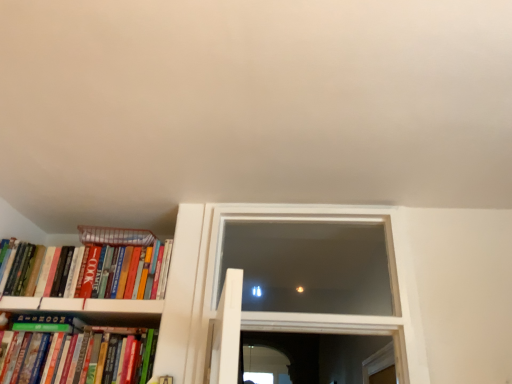
Where is `hardcover books at left, positioned as the 1th book in top-to-bottom order`? This screenshot has height=384, width=512. hardcover books at left, positioned as the 1th book in top-to-bottom order is located at coordinates (91, 269).

What do you see at coordinates (91, 269) in the screenshot? I see `hardcover books at left, positioned as the 1th book in top-to-bottom order` at bounding box center [91, 269].

What is the approximate width of striped paper at left?

striped paper at left is 10.35 inches in width.

This screenshot has height=384, width=512. What do you see at coordinates (115, 236) in the screenshot? I see `striped paper at left` at bounding box center [115, 236].

Measure the distance between transparent glass window at center and camera.

transparent glass window at center and camera are 1.61 meters apart.

What are the coordinates of `transparent glass window at center` in the screenshot? It's located at (313, 313).

How much space does green matte bookshelf at lower left, arranged as the 1th book when ordered from the bottom, occupy vertically?

The height of green matte bookshelf at lower left, arranged as the 1th book when ordered from the bottom, is 29.06 centimeters.

This screenshot has width=512, height=384. Identify the location of hardcover books at left, positioned as the 1th book in top-to-bottom order. (91, 269).

Does hardcover books at left, positioned as the 1th book in top-to-bottom order, turn towards striped paper at left?

No, hardcover books at left, positioned as the 1th book in top-to-bottom order, is not facing towards striped paper at left.

In the scene shown: Which object is wider, hardcover books at left, acting as the second book starting from the bottom, or striped paper at left?

striped paper at left.

In the image, is hardcover books at left, positioned as the 1th book in top-to-bottom order, on the left side or the right side of striped paper at left?

Based on their positions, hardcover books at left, positioned as the 1th book in top-to-bottom order, is located to the left of striped paper at left.

From the picture: From a real-world perspective, is hardcover books at left, acting as the second book starting from the bottom, physically located above or below striped paper at left?

From a real-world perspective, hardcover books at left, acting as the second book starting from the bottom, is physically below striped paper at left.

In the scene shown: Between transparent glass window at center and hardcover books at left, acting as the second book starting from the bottom, which one appears on the right side from the viewer's perspective?

transparent glass window at center is more to the right.

What's the angular difference between transparent glass window at center and hardcover books at left, acting as the second book starting from the bottom,'s facing directions?

There is a 0.0872-degree angle between the facing directions of transparent glass window at center and hardcover books at left, acting as the second book starting from the bottom.

Does point (251, 210) come in front of point (124, 267)?

No, it is not.

Is striped paper at left located within green matte bookshelf at lower left, marked as the second book in a top-to-bottom arrangement?

No, striped paper at left is not surrounded by green matte bookshelf at lower left, marked as the second book in a top-to-bottom arrangement.

Does green matte bookshelf at lower left, arranged as the 1th book when ordered from the bottom, have a greater width compared to striped paper at left?

No.

Which point is more distant from viewer, (31, 332) or (79, 238)?

The point (79, 238) is behind.

In the scene shown: Is the position of green matte bookshelf at lower left, arranged as the 1th book when ordered from the bottom, more distant than that of striped paper at left?

No, green matte bookshelf at lower left, arranged as the 1th book when ordered from the bottom, is closer to the camera.

Is green matte bookshelf at lower left, marked as the second book in a top-to-bottom arrangement, in front of or behind hardcover books at left, acting as the second book starting from the bottom, in the image?

Visually, green matte bookshelf at lower left, marked as the second book in a top-to-bottom arrangement, is located in front of hardcover books at left, acting as the second book starting from the bottom.

In terms of width, does green matte bookshelf at lower left, marked as the second book in a top-to-bottom arrangement, look wider or thinner when compared to hardcover books at left, acting as the second book starting from the bottom?

Clearly, green matte bookshelf at lower left, marked as the second book in a top-to-bottom arrangement, has less width compared to hardcover books at left, acting as the second book starting from the bottom.

In the scene shown: Which is more to the right, green matte bookshelf at lower left, arranged as the 1th book when ordered from the bottom, or hardcover books at left, positioned as the 1th book in top-to-bottom order?

green matte bookshelf at lower left, arranged as the 1th book when ordered from the bottom, is more to the right.

How different are the orientations of green matte bookshelf at lower left, arranged as the 1th book when ordered from the bottom, and hardcover books at left, acting as the second book starting from the bottom, in degrees?

The facing directions of green matte bookshelf at lower left, arranged as the 1th book when ordered from the bottom, and hardcover books at left, acting as the second book starting from the bottom, are 0.405 degrees apart.

In the scene shown: Is hardcover books at left, positioned as the 1th book in top-to-bottom order, with green matte bookshelf at lower left, arranged as the 1th book when ordered from the bottom?

hardcover books at left, positioned as the 1th book in top-to-bottom order, is not next to green matte bookshelf at lower left, arranged as the 1th book when ordered from the bottom, and they're not touching.

What's the angular difference between hardcover books at left, positioned as the 1th book in top-to-bottom order, and green matte bookshelf at lower left, arranged as the 1th book when ordered from the bottom,'s facing directions?

hardcover books at left, positioned as the 1th book in top-to-bottom order, and green matte bookshelf at lower left, arranged as the 1th book when ordered from the bottom, are facing 0.405 degrees away from each other.

Considering the positions of objects hardcover books at left, positioned as the 1th book in top-to-bottom order, and green matte bookshelf at lower left, marked as the second book in a top-to-bottom arrangement, in the image provided, who is behind, hardcover books at left, positioned as the 1th book in top-to-bottom order, or green matte bookshelf at lower left, marked as the second book in a top-to-bottom arrangement,?

hardcover books at left, positioned as the 1th book in top-to-bottom order, is behind.

From the image's perspective, which is below, hardcover books at left, positioned as the 1th book in top-to-bottom order, or green matte bookshelf at lower left, arranged as the 1th book when ordered from the bottom?

green matte bookshelf at lower left, arranged as the 1th book when ordered from the bottom, is shown below in the image.

Is point (94, 226) in front of point (122, 288)?

No, it is not.

From a real-world perspective, between striped paper at left and hardcover books at left, acting as the second book starting from the bottom, who is vertically lower?

hardcover books at left, acting as the second book starting from the bottom, from a real-world perspective.

Which object is further away from the camera, striped paper at left or hardcover books at left, acting as the second book starting from the bottom?

Positioned behind is striped paper at left.

Is striped paper at left spatially inside hardcover books at left, acting as the second book starting from the bottom, or outside of it?

striped paper at left is located beyond the bounds of hardcover books at left, acting as the second book starting from the bottom.

Find the location of a particular element. This screenshot has width=512, height=384. window located above the hardcover books at left, positioned as the 1th book in top-to-bottom order (from the image's perspective) is located at coordinates (313, 313).

Which is more to the left, hardcover books at left, positioned as the 1th book in top-to-bottom order, or transparent glass window at center?

hardcover books at left, positioned as the 1th book in top-to-bottom order, is more to the left.

Who is shorter, hardcover books at left, positioned as the 1th book in top-to-bottom order, or transparent glass window at center?

hardcover books at left, positioned as the 1th book in top-to-bottom order.

Can we say hardcover books at left, positioned as the 1th book in top-to-bottom order, lies outside transparent glass window at center?

Absolutely, hardcover books at left, positioned as the 1th book in top-to-bottom order, is external to transparent glass window at center.

From the image's perspective, which book is the 1st one below the striped paper at left? Please provide its 2D coordinates.

[(91, 269)]

Starting from the transparent glass window at center, which book is the 2nd one to the left? Please provide its 2D coordinates.

[(91, 269)]

From the image, which object appears to be farther from striped paper at left, green matte bookshelf at lower left, marked as the second book in a top-to-bottom arrangement, or transparent glass window at center?

Among the two, transparent glass window at center is located further to striped paper at left.

When comparing their distances from striped paper at left, does hardcover books at left, acting as the second book starting from the bottom, or green matte bookshelf at lower left, marked as the second book in a top-to-bottom arrangement, seem closer?

hardcover books at left, acting as the second book starting from the bottom, is positioned closer to the anchor striped paper at left.

Which object lies nearer to the anchor point transparent glass window at center, hardcover books at left, positioned as the 1th book in top-to-bottom order, or green matte bookshelf at lower left, marked as the second book in a top-to-bottom arrangement?

Based on the image, hardcover books at left, positioned as the 1th book in top-to-bottom order, appears to be nearer to transparent glass window at center.

Looking at this image, when comparing their distances from striped paper at left, does transparent glass window at center or hardcover books at left, acting as the second book starting from the bottom, seem closer?

Among the two, hardcover books at left, acting as the second book starting from the bottom, is located nearer to striped paper at left.

Estimate the real-world distances between objects in this image. Which object is closer to hardcover books at left, positioned as the 1th book in top-to-bottom order, transparent glass window at center or striped paper at left?

striped paper at left is positioned closer to the anchor hardcover books at left, positioned as the 1th book in top-to-bottom order.

Considering their positions, is green matte bookshelf at lower left, marked as the second book in a top-to-bottom arrangement, positioned closer to striped paper at left than hardcover books at left, acting as the second book starting from the bottom?

Based on the image, hardcover books at left, acting as the second book starting from the bottom, appears to be nearer to striped paper at left.

When comparing their distances from transparent glass window at center, does hardcover books at left, acting as the second book starting from the bottom, or striped paper at left seem closer?

hardcover books at left, acting as the second book starting from the bottom, is positioned closer to the anchor transparent glass window at center.

Considering their positions, is striped paper at left positioned closer to transparent glass window at center than hardcover books at left, positioned as the 1th book in top-to-bottom order?

Based on the image, hardcover books at left, positioned as the 1th book in top-to-bottom order, appears to be nearer to transparent glass window at center.

This screenshot has height=384, width=512. I want to click on paperback book between green matte bookshelf at lower left, arranged as the 1th book when ordered from the bottom, and transparent glass window at center from left to right, so click(115, 236).

Identify the location of book between striped paper at left and green matte bookshelf at lower left, arranged as the 1th book when ordered from the bottom, vertically. (91, 269).

What are the coordinates of `paperback book situated between hardcover books at left, positioned as the 1th book in top-to-bottom order, and transparent glass window at center from left to right` in the screenshot? It's located at (115, 236).

I want to click on book situated between hardcover books at left, positioned as the 1th book in top-to-bottom order, and transparent glass window at center from left to right, so click(78, 354).